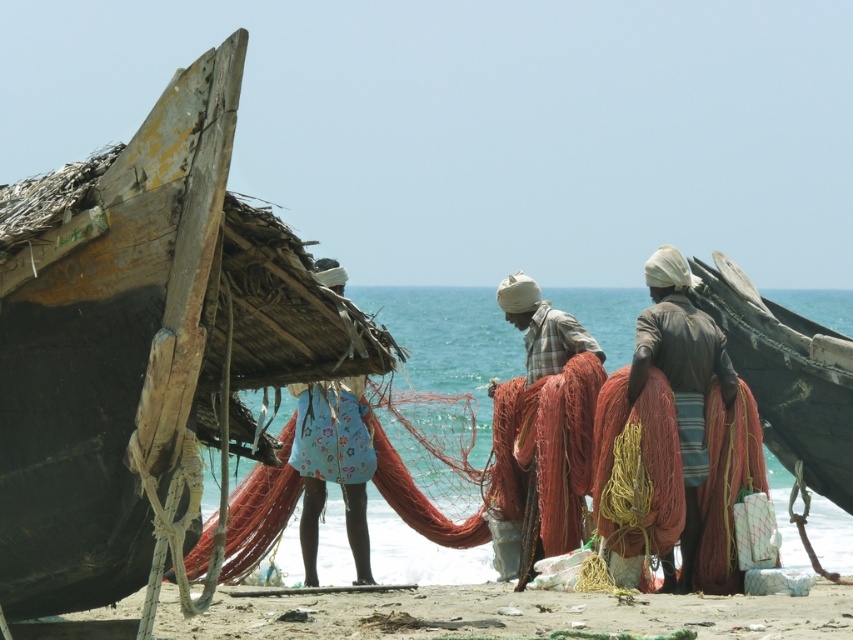
Question: Observing the image, what is the correct spatial positioning of brown leather jacket at center in reference to rustic woven net at center?

Choices:
 (A) below
 (B) above

Answer: (A)

Question: Where is wooden boat at right located in relation to brown leather jacket at center in the image?

Choices:
 (A) right
 (B) left

Answer: (A)

Question: Is sandy beach at lower center to the right of floral fabric skirt at left from the viewer's perspective?

Choices:
 (A) yes
 (B) no

Answer: (A)

Question: Among these objects, which one is nearest to the camera?

Choices:
 (A) rustic woven net at center
 (B) translucent water at center

Answer: (B)

Question: Which point is farther to the camera?

Choices:
 (A) weathered wood boat at left
 (B) brown leather jacket at center
 (C) wooden boat at right

Answer: (C)

Question: Which object is the closest to the wooden boat at right?

Choices:
 (A) weathered wood boat at left
 (B) rustic woven net at center
 (C) floral fabric skirt at left
 (D) translucent water at center

Answer: (B)